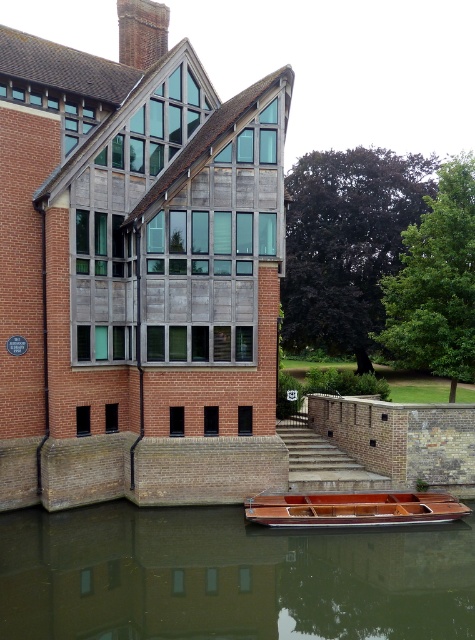
You are standing at the center of the image. Where is the brown wooden boat at lower center located in relation to your position?

The brown wooden boat at lower center is located at point (x=228, y=577) in the image.

You are standing in front of the modern building by the water. There are two points marked on the building structure. The first point is located at coordinates point (x=427, y=570) and the second at point (x=316, y=497). Which of these two points is closer to your viewpoint?

Point (x=427, y=570) is closer to the camera than point (x=316, y=497).